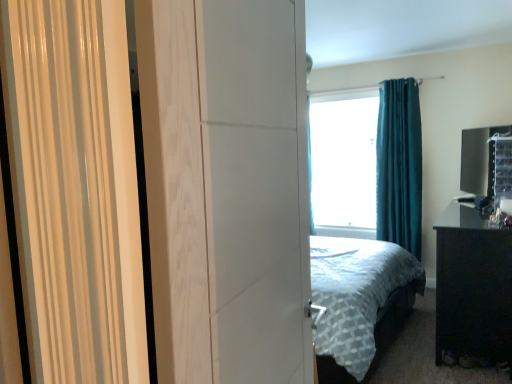
Question: Is black glossy nightstand at right wider or thinner than teal velvet curtain at upper right?

Choices:
 (A) wide
 (B) thin

Answer: (A)

Question: From a real-world perspective, is black glossy nightstand at right positioned above or below teal velvet curtain at upper right?

Choices:
 (A) above
 (B) below

Answer: (B)

Question: Estimate the real-world distances between objects in this image. Which object is farther from the transparent glass window screen at center?

Choices:
 (A) white matte screen door at center
 (B) black glossy nightstand at right
 (C) teal velvet curtain at upper right

Answer: (A)

Question: Based on their relative distances, which object is farther from the black glossy nightstand at right?

Choices:
 (A) teal velvet curtain at upper right
 (B) white matte screen door at center
 (C) transparent glass window screen at center

Answer: (B)